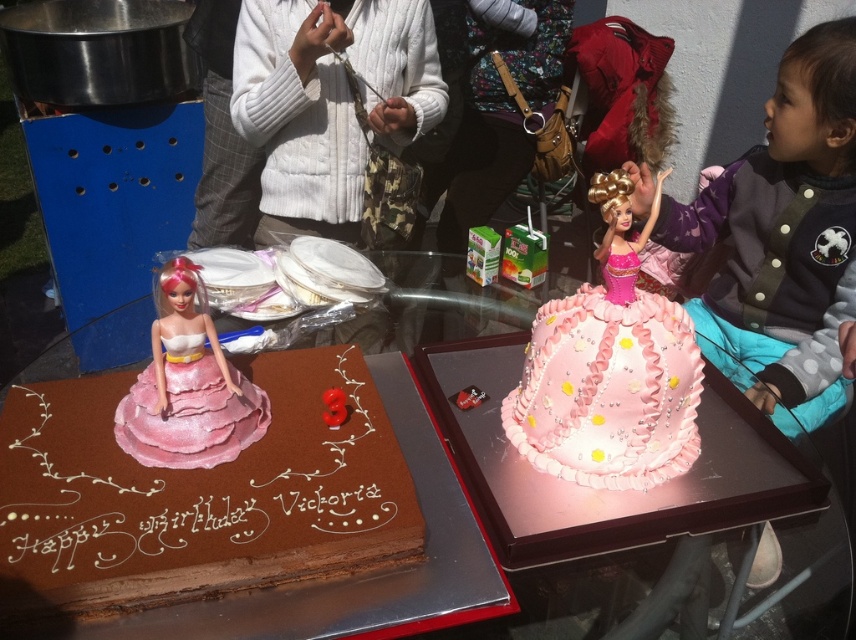
You are a guest at the birthday party and want to take a photo of both the chocolate matte cake at left and the white fuzzy sweater at upper center. Which cake should you stand closer to to include both in the frame?

You should stand closer to the chocolate matte cake at left because it is positioned on the right side of the white fuzzy sweater at upper center, so moving closer to the cake will help capture both objects in the photo frame.

You are a birthday guest holding a gift box that is 12 inches wide. You want to place it between the chocolate matte cake at left and the white fuzzy sweater at upper center. Is there enough space for the gift box?

The distance between the chocolate matte cake at left and the white fuzzy sweater at upper center is 37.53 inches. Since the gift box is only 12 inches wide, there is sufficient space to place it between them.